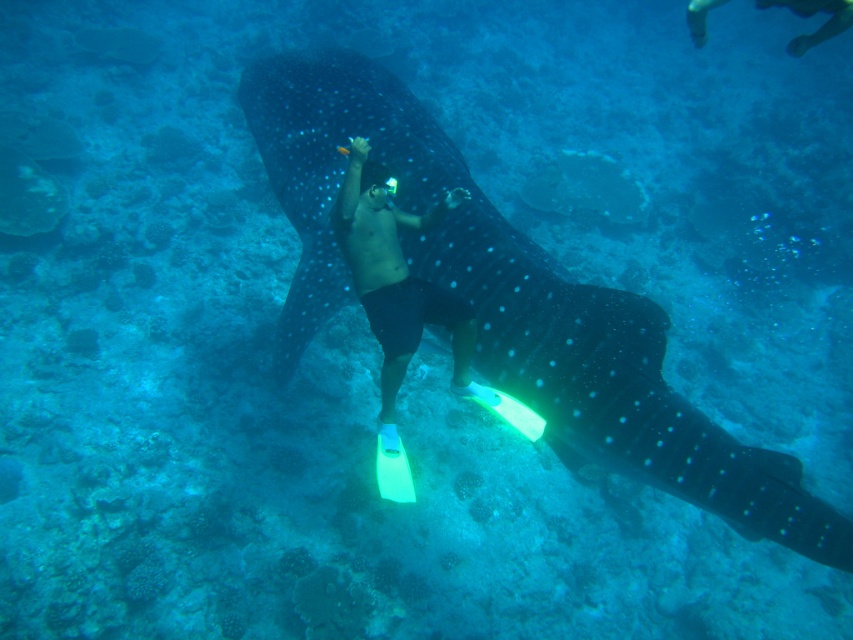
You are a marine biologist observing an underwater scene. A point labeled as point (511, 304) is marked in the image. Based on the scene description, what does this point most likely represent?

The point (511, 304) marks the location of the spotted dark blue skin at center, which corresponds to the whale shark in the scene.

You are a marine biologist filming an underwater documentary. Your camera has a maximum focus range of 2 meters. Can you clearly capture the spotted dark blue skin at center in your footage?

The spotted dark blue skin at center is 2.14 meters away from the camera, which exceeds the maximum focus range of 2 meters. Therefore, the camera cannot clearly capture the spotted dark blue skin at center in the footage.

You are a marine biologist observing an underwater scene. You notice the spotted dark blue skin at center and the matte black shorts at center. Based on their positions, which object is closer to your right side?

The spotted dark blue skin at center is to the right of matte black shorts at center, so the spotted dark blue skin at center is closer to your right side.